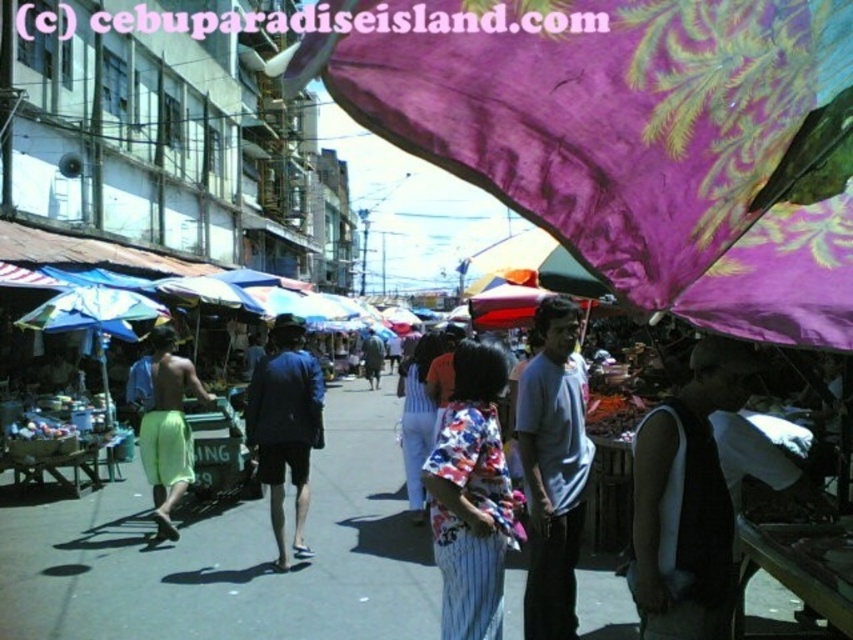
Is purple fabric umbrella at upper center further to camera compared to dark gray sleeveless shirt at center?

No, it is not.

Is point (498, 35) in front of point (721, 547)?

Yes, point (498, 35) is closer to viewer.

This screenshot has height=640, width=853. What are the coordinates of `purple fabric umbrella at upper center` in the screenshot? It's located at (636, 140).

Who is shorter, purple fabric umbrella at upper center or floral fabric dress at center?

purple fabric umbrella at upper center

Is point (621, 205) closer to viewer compared to point (486, 524)?

Yes.

Where is `purple fabric umbrella at upper center`? purple fabric umbrella at upper center is located at coordinates (636, 140).

Consider the image. Can you confirm if purple fabric umbrella at upper center is positioned below neon yellow shorts at center?

Actually, purple fabric umbrella at upper center is above neon yellow shorts at center.

Which is in front, point (546, 65) or point (155, 486)?

Point (546, 65) is more forward.

Identify the location of purple fabric umbrella at upper center. (636, 140).